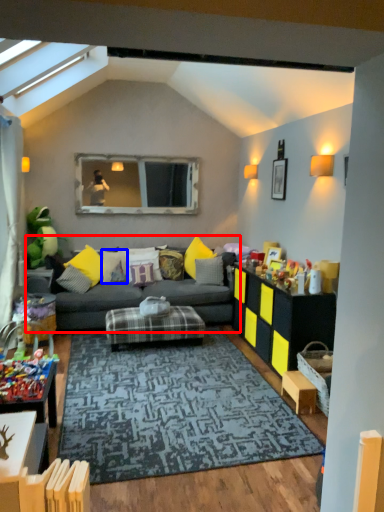
Question: Among these objects, which one is farthest to the camera, studio couch (highlighted by a red box) or pillow (highlighted by a blue box)?

Choices:
 (A) studio couch
 (B) pillow

Answer: (B)